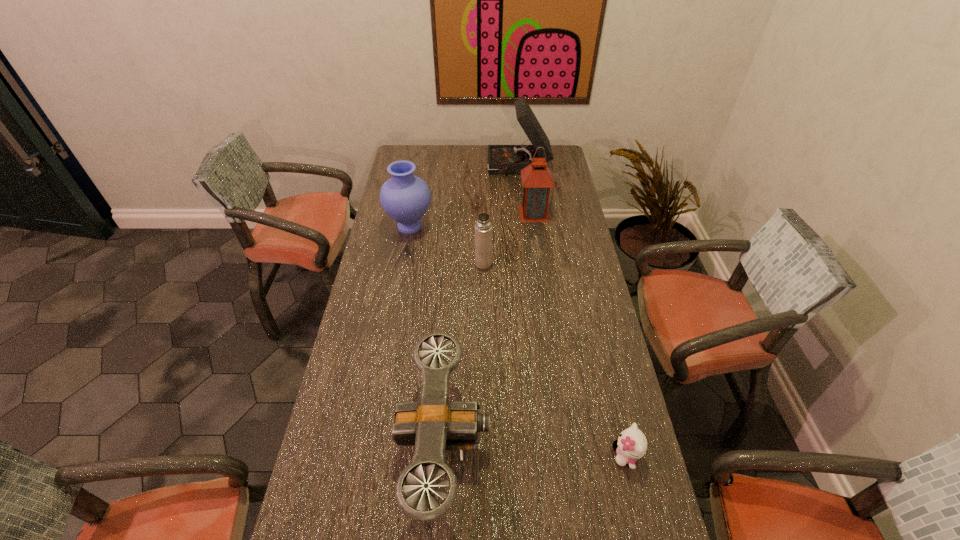
Locate an element on the screen. The image size is (960, 540). lantern is located at coordinates (537, 179).

This screenshot has width=960, height=540. Find the location of `phonograph_record`. phonograph_record is located at coordinates (502, 159).

The width and height of the screenshot is (960, 540). Find the location of `vase`. vase is located at coordinates (405, 198).

Find the location of a particular element. the fourth farthest object is located at coordinates (483, 228).

Where is `thermos bottle`? The image size is (960, 540). thermos bottle is located at coordinates (483, 228).

The image size is (960, 540). What are the coordinates of `the rightmost object` in the screenshot? It's located at (631, 445).

Where is `the shortest object`? This screenshot has width=960, height=540. the shortest object is located at coordinates (631, 445).

The width and height of the screenshot is (960, 540). I want to click on free point located on the left of the lantern, so click(449, 213).

The width and height of the screenshot is (960, 540). In order to click on free point located 0.090m on the front-facing side of the farthest object in this screenshot , I will do (x=469, y=167).

The width and height of the screenshot is (960, 540). What are the coordinates of `vacant point located 0.060m on the front-facing side of the farthest object` in the screenshot? It's located at (475, 167).